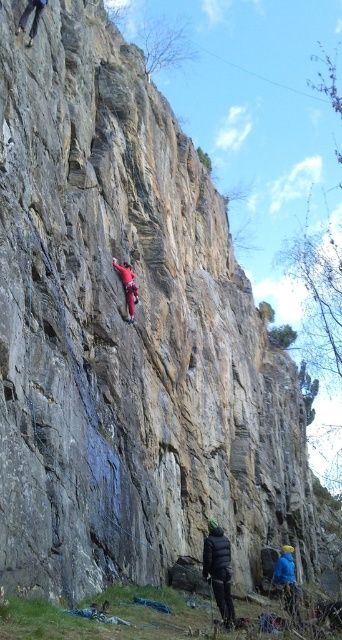
You are a drone operator tasked with capturing aerial footage of the climbing scene. You need to fly your drone from the point at coordinates point (230, 580) to the point at coordinates point (134, 280). Based on the spatial relationship between these two points, will the drone have to fly over or behind the cliff face to reach its destination?

Point (230, 580) is in front of point (134, 280), so the drone will have to fly behind the cliff face to reach its destination.

Looking at this image, what is the object located at the coordinates point (x=218, y=570) in the image?

The point (x=218, y=570) indicates the black puffy jacket at lower center.